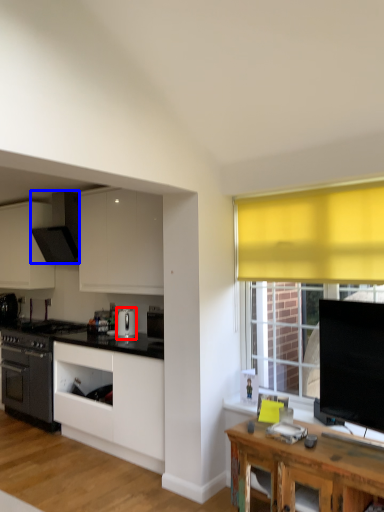
Question: Among these objects, which one is nearest to the camera, kitchen appliance (highlighted by a red box) or kitchen appliance (highlighted by a blue box)?

Choices:
 (A) kitchen appliance
 (B) kitchen appliance

Answer: (A)